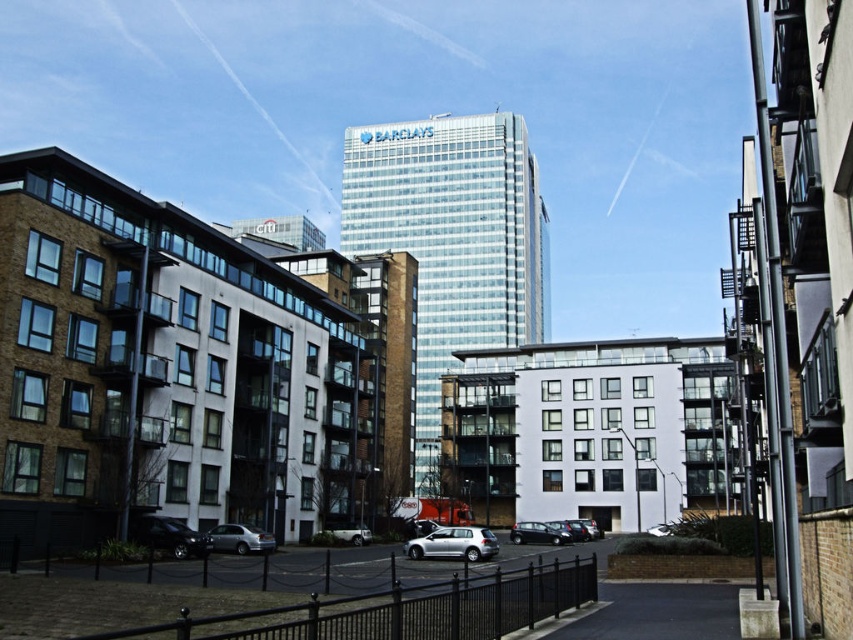
Who is higher up, shiny black sedan at lower left or metallic silver car at center?

shiny black sedan at lower left is above.

Which is behind, point (178, 528) or point (666, 529)?

The point (666, 529) is behind.

Is point (132, 524) positioned after point (674, 528)?

No, (132, 524) is closer to viewer.

This screenshot has height=640, width=853. What are the coordinates of `shiny black sedan at lower left` in the screenshot? It's located at (167, 536).

Who is shorter, satin silver sedan at lower left or silver metallic car at center?

Standing shorter between the two is satin silver sedan at lower left.

How distant is satin silver sedan at lower left from silver metallic car at center?

The distance of satin silver sedan at lower left from silver metallic car at center is 19.47 meters.

Which is in front, point (207, 536) or point (370, 534)?

Positioned in front is point (207, 536).

Where is `satin silver sedan at lower left`? This screenshot has width=853, height=640. satin silver sedan at lower left is located at coordinates (239, 538).

Is point (224, 550) positioned in front of point (657, 531)?

Yes, point (224, 550) is closer to viewer.

Between satin silver sedan at lower left and metallic silver car at center, which one has less height?

satin silver sedan at lower left is shorter.

Who is more distant from viewer, (273, 538) or (662, 532)?

Point (662, 532)

The image size is (853, 640). In order to click on satin silver sedan at lower left in this screenshot , I will do `click(239, 538)`.